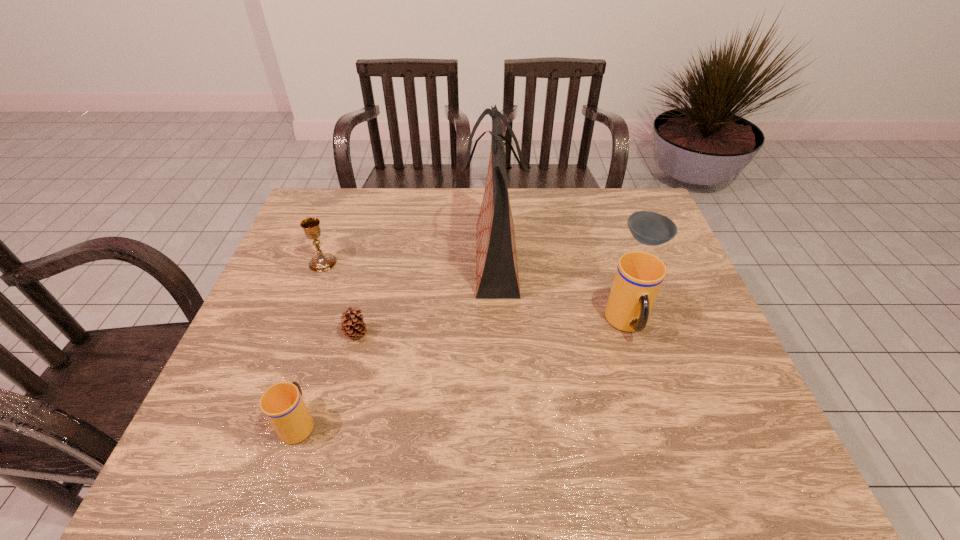
If we want them evenly spaced by inserting an extra cup among them, please locate a free spot for this new cup. Please provide its 2D coordinates. Your answer should be formatted as a tuple, i.e. [(x, y)], where the tuple contains the x and y coordinates of a point satisfying the conditions above.

[(479, 368)]